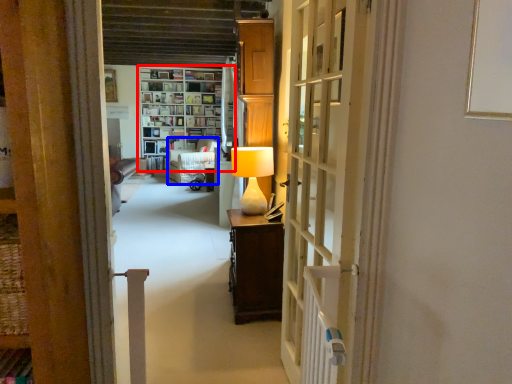
Question: Which object is closer to the camera taking this photo, shelf (highlighted by a red box) or armchair (highlighted by a blue box)?

Choices:
 (A) shelf
 (B) armchair

Answer: (B)